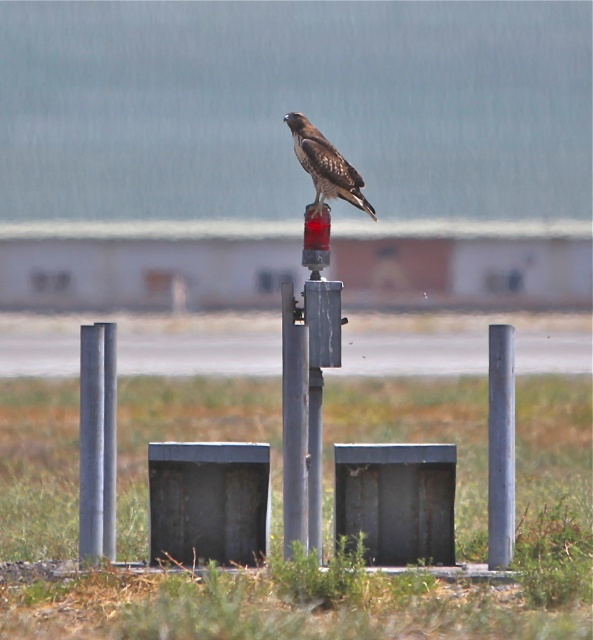
Which is below, metallic gray post at left or brown speckled feathers at center?

metallic gray post at left is below.

Is point (114, 378) closer to viewer compared to point (318, 132)?

Yes.

Which is in front, point (107, 545) or point (326, 166)?

Point (107, 545)

Identify the location of metallic gray post at left. The width and height of the screenshot is (593, 640). point(97,442).

Between silver metallic post at center-right and brown speckled feathers at center, which one has less height?

Standing shorter between the two is brown speckled feathers at center.

Between point (502, 384) and point (298, 118), which one is positioned behind?

Positioned behind is point (298, 118).

Between point (495, 561) and point (304, 116), which one is positioned behind?

The point (304, 116) is more distant.

This screenshot has width=593, height=640. In order to click on silver metallic post at center-right in this screenshot , I will do `click(500, 445)`.

Does metallic gray post at left have a greater height compared to silver metallic post at center-right?

No.

Does metallic gray post at left have a lesser height compared to silver metallic post at center-right?

Indeed, metallic gray post at left has a lesser height compared to silver metallic post at center-right.

Measure the distance between point (90,464) and camera.

35.86 feet

Locate an element on the screen. This screenshot has height=640, width=593. metallic gray post at left is located at coordinates (97, 442).